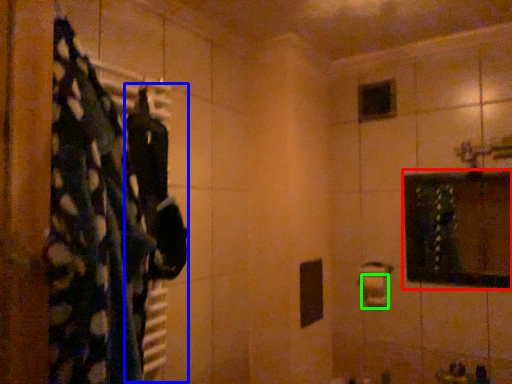
Question: Which object is positioned farthest from medicine cabinet (highlighted by a red box)? Select from clothing (highlighted by a blue box) and toilet paper (highlighted by a green box).

Choices:
 (A) clothing
 (B) toilet paper

Answer: (A)